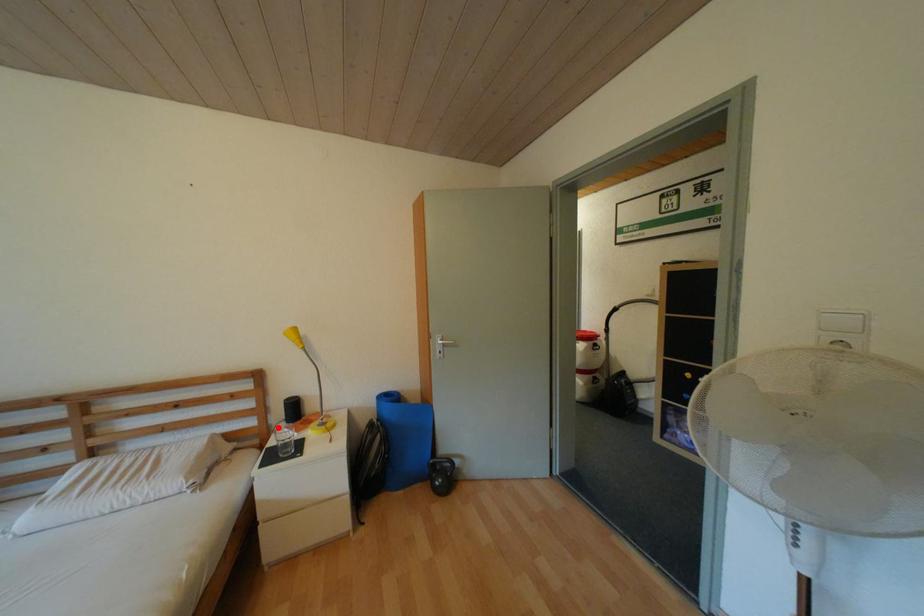
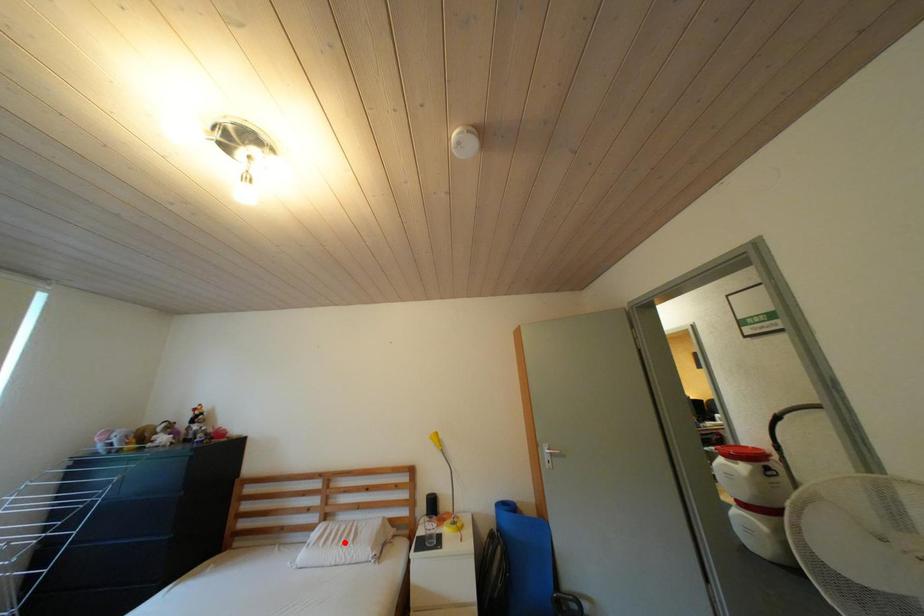
I am providing you with two images of the same scene from different viewpoints. A red point is marked on the first image and another point is marked on the second image. Does the point marked in image1 correspond to the same location as the one in image2?

No